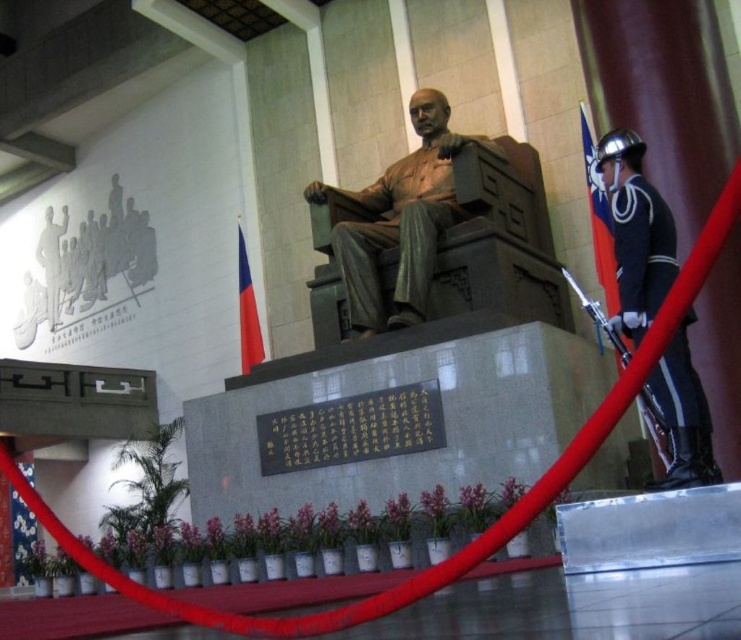
Question: Among these points, which one is farthest from the camera?

Choices:
 (A) (664, 275)
 (B) (356, 285)

Answer: (B)

Question: Does shiny blue uniform at center appear on the right side of shiny blue uniform at right?

Choices:
 (A) yes
 (B) no

Answer: (B)

Question: Observing the image, what is the correct spatial positioning of shiny blue uniform at center in reference to shiny blue uniform at right?

Choices:
 (A) left
 (B) right

Answer: (A)

Question: Does shiny blue uniform at center appear over shiny blue uniform at right?

Choices:
 (A) no
 (B) yes

Answer: (B)